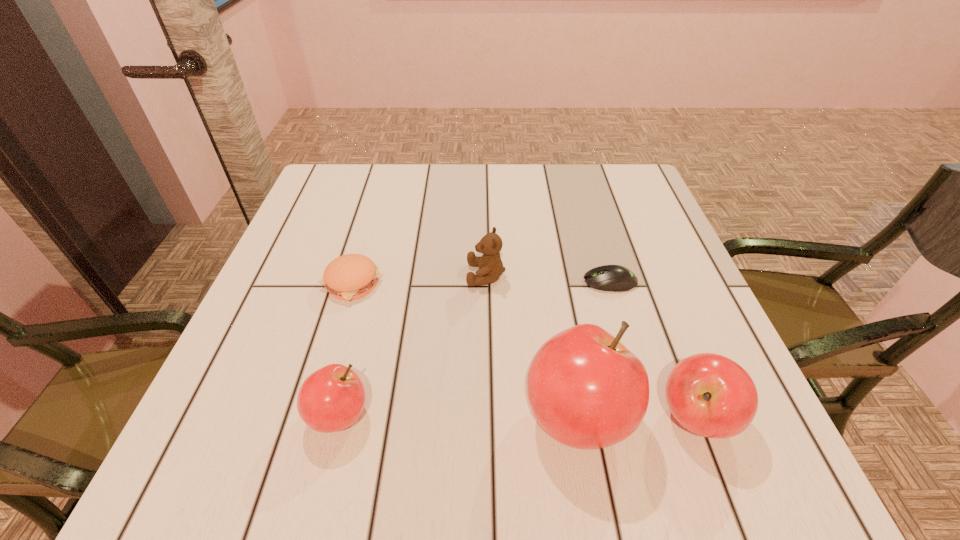
Please point a spot to place another apple for symmetrical spacing. Please provide its 2D coordinates. Your answer should be formatted as a tuple, i.e. [(x, y)], where the tuple contains the x and y coordinates of a point satisfying the conditions above.

[(458, 416)]